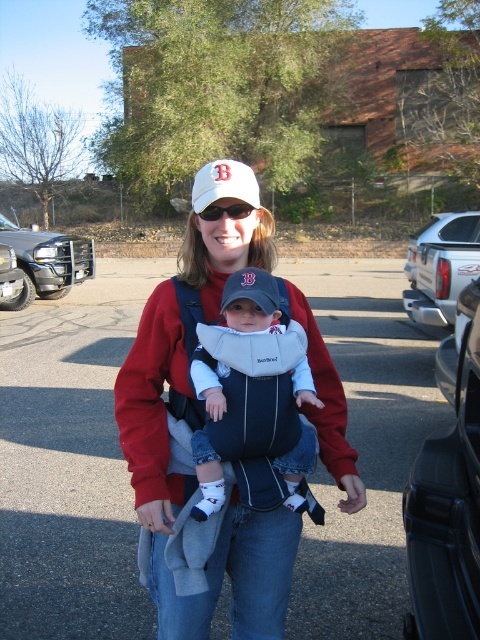
Based on the coordinates provided, what object is located at point [184,492]?

The point [184,492] corresponds to the matte red sweatshirt at center.

Consider the image. You are standing in a parking lot and see two points marked in the image. The first point is at coordinate point(294, 520) and the second point is at coordinate point(419, 289). Which point is closer to you?

Point(294, 520) is closer to the camera than point(419, 289), so the first point is closer to you.